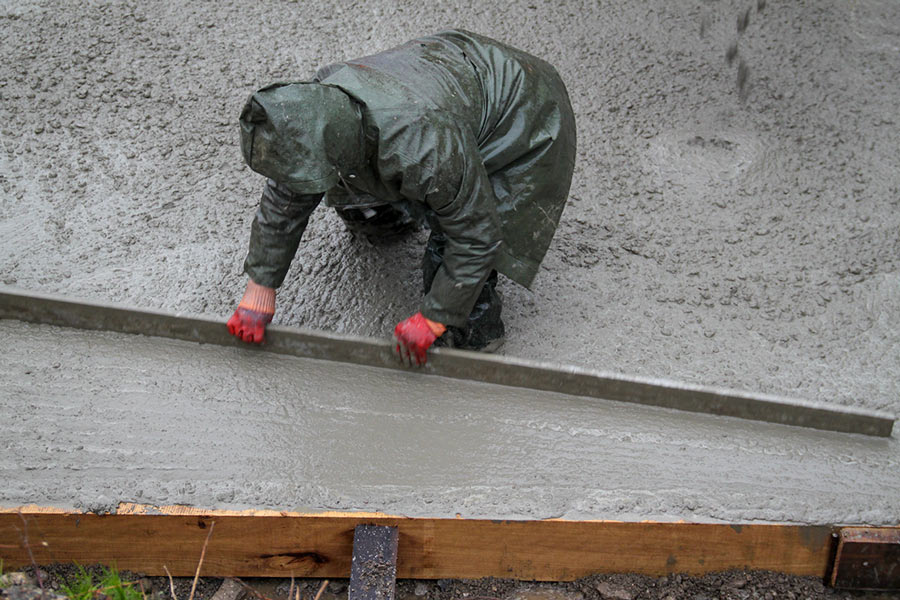
This screenshot has height=600, width=900. Find the location of `beam`. beam is located at coordinates (363, 549).